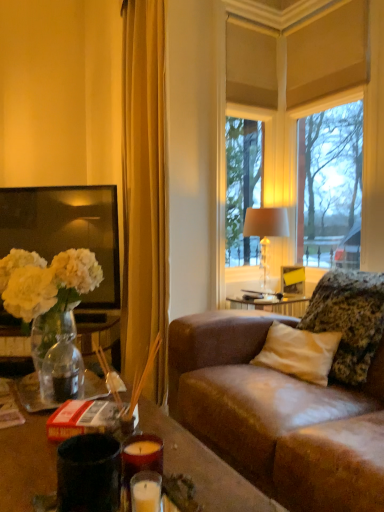
Question: Is translucent glass vase at left not near clear glass window at center?

Choices:
 (A) yes
 (B) no

Answer: (A)

Question: Is translucent glass vase at left oriented towards clear glass window at center?

Choices:
 (A) no
 (B) yes

Answer: (A)

Question: Can you confirm if translucent glass vase at left is taller than clear glass window at center?

Choices:
 (A) yes
 (B) no

Answer: (B)

Question: Considering the relative positions of translucent glass vase at left and clear glass window at center in the image provided, is translucent glass vase at left to the left of clear glass window at center from the viewer's perspective?

Choices:
 (A) yes
 (B) no

Answer: (A)

Question: From a real-world perspective, is translucent glass vase at left positioned over clear glass window at center based on gravity?

Choices:
 (A) no
 (B) yes

Answer: (A)

Question: In terms of size, does clear glass window at center appear bigger or smaller than translucent glass vase at left?

Choices:
 (A) big
 (B) small

Answer: (A)

Question: From a real-world perspective, is clear glass window at center physically located above or below translucent glass vase at left?

Choices:
 (A) above
 (B) below

Answer: (A)

Question: Relative to translucent glass vase at left, is clear glass window at center in front or behind?

Choices:
 (A) front
 (B) behind

Answer: (B)

Question: Is point (309, 54) positioned closer to the camera than point (71, 301)?

Choices:
 (A) farther
 (B) closer

Answer: (A)

Question: From their relative heights in the image, would you say fluffy textured pillow at right is taller or shorter than clear glass window at center?

Choices:
 (A) short
 (B) tall

Answer: (A)

Question: In terms of size, does fluffy textured pillow at right appear bigger or smaller than clear glass window at center?

Choices:
 (A) big
 (B) small

Answer: (B)

Question: In the image, is fluffy textured pillow at right on the left side or the right side of clear glass window at center?

Choices:
 (A) right
 (B) left

Answer: (B)

Question: From a real-world perspective, is fluffy textured pillow at right positioned above or below clear glass window at center?

Choices:
 (A) below
 (B) above

Answer: (A)

Question: Is point (198, 480) positioned closer to the camera than point (306, 325)?

Choices:
 (A) closer
 (B) farther

Answer: (A)

Question: From the image's perspective, is matte red candle at lower center positioned above or below fluffy textured pillow at right?

Choices:
 (A) above
 (B) below

Answer: (B)